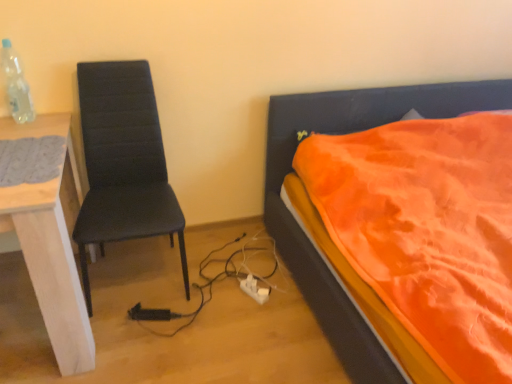
Where is `free space that is in between white wood desk at left and matte black chair at left`? free space that is in between white wood desk at left and matte black chair at left is located at coordinates (134, 331).